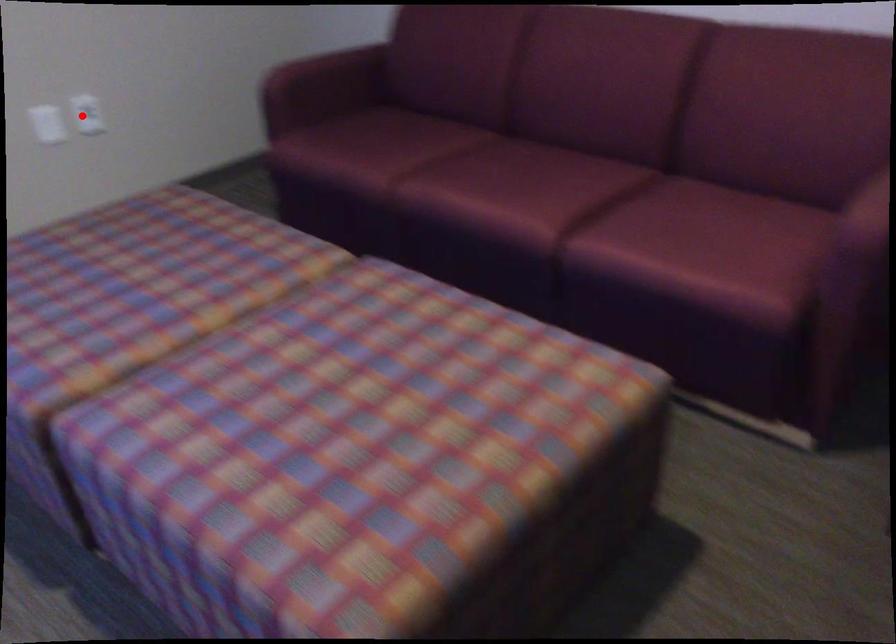
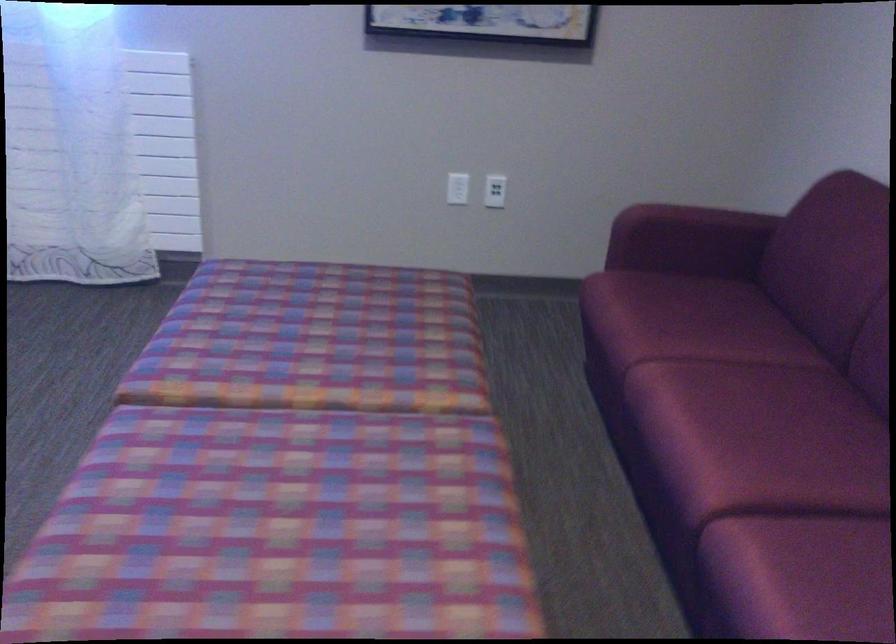
Question: I am providing you with two images of the same scene from different viewpoints. In image1, a red point is highlighted. Considering the same 3D point in image2, which of the following is correct?

Choices:
 (A) It is closer
 (B) It is farther

Answer: (B)